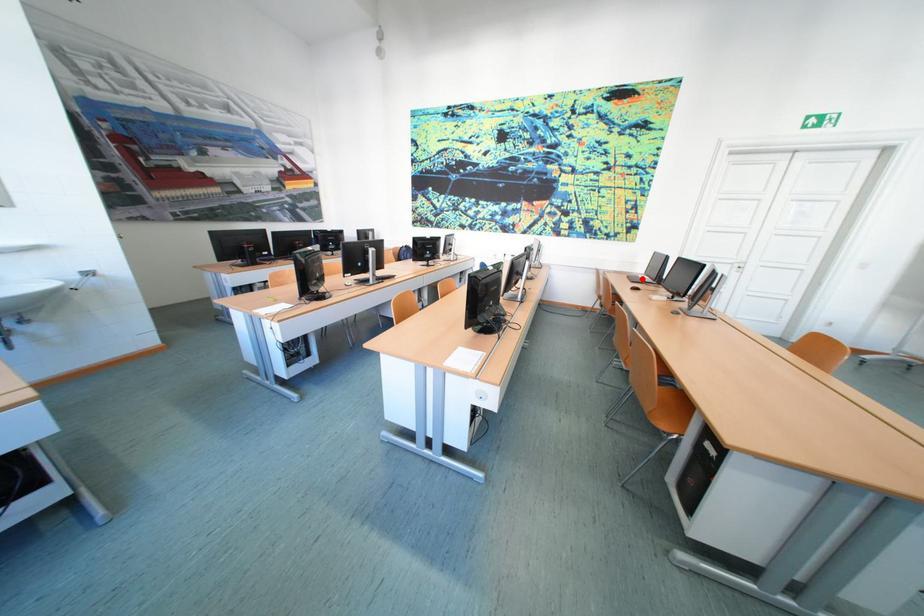
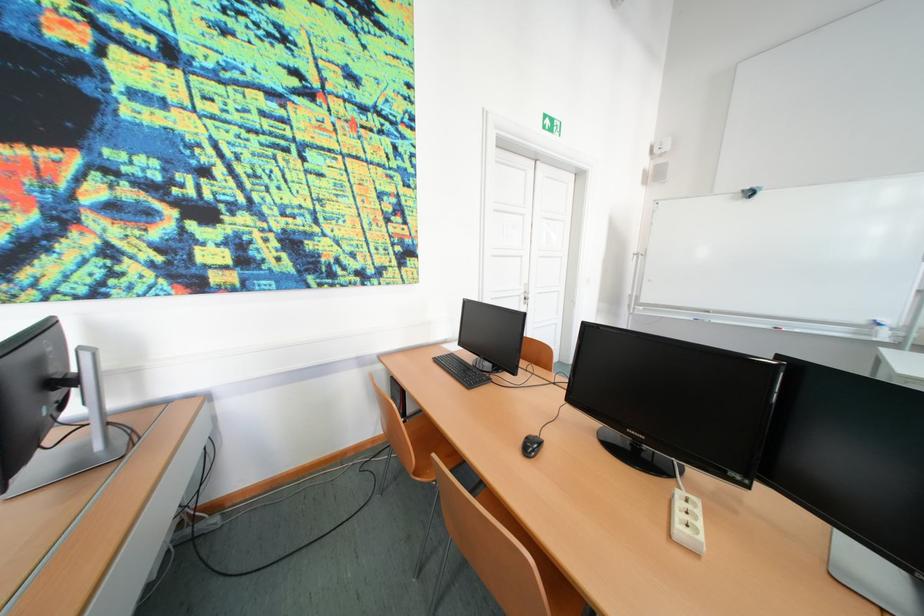
Find the pixel in the second image that matches the highlighted location in the first image.

(450, 363)